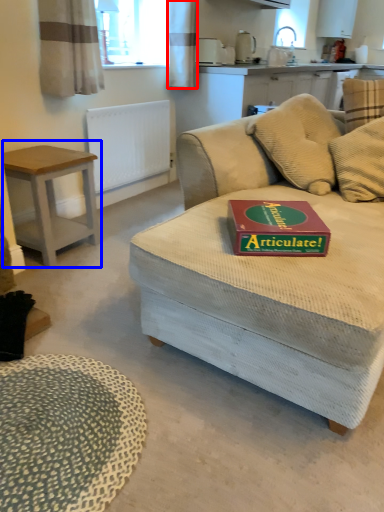
Question: Which object is closer to the camera taking this photo, curtain (highlighted by a red box) or table (highlighted by a blue box)?

Choices:
 (A) curtain
 (B) table

Answer: (B)